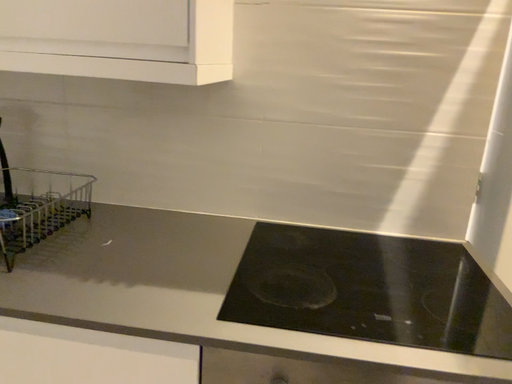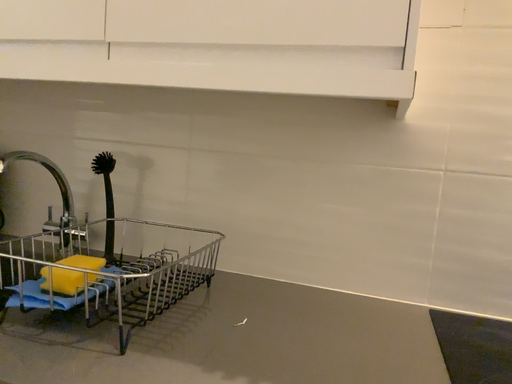
Question: How did the camera likely rotate when shooting the video?

Choices:
 (A) rotated left
 (B) rotated right

Answer: (A)